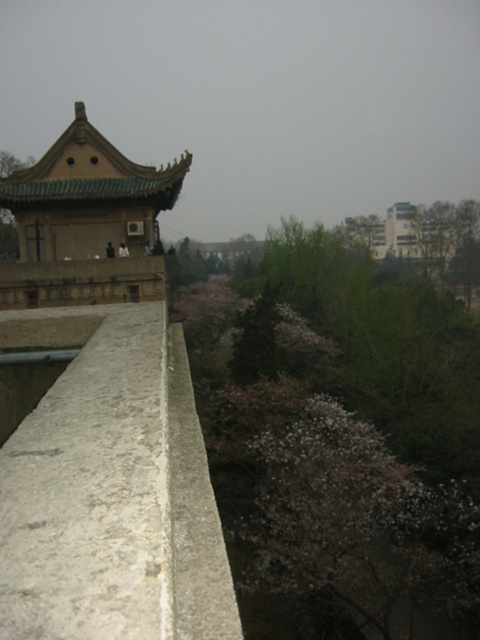
You are a bird looking for a place to perch. You see the bare branches at center and the green glazed tile temple at upper left. Which one is taller?

The bare branches at center is much taller than the green glazed tile temple at upper left, so you should choose the bare branches at center to perch.

You are standing in front of the stone wall and see the bare branches at center and the green glazed tile temple at upper left. Which object is positioned to the right side of the other?

The bare branches at center is to the right of green glazed tile temple at upper left.